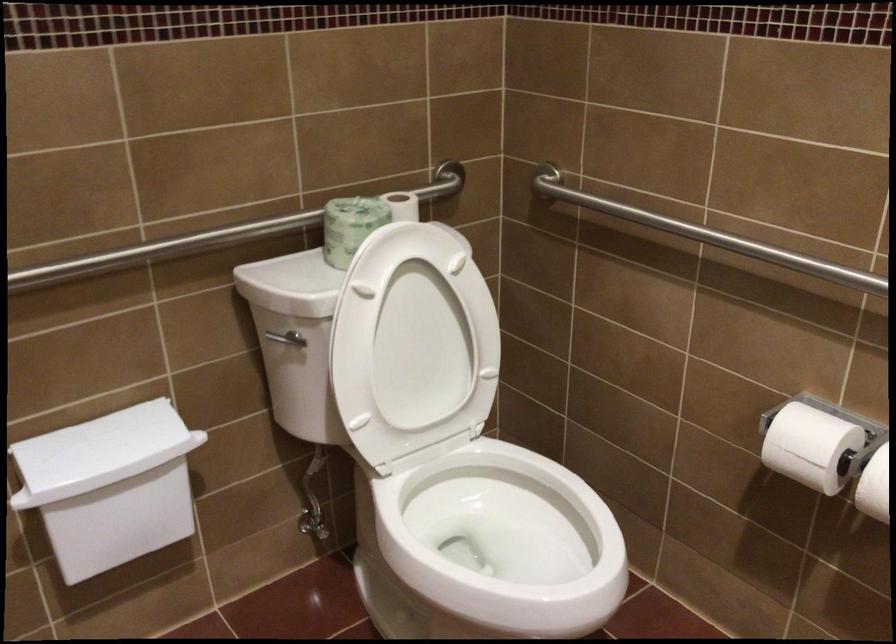
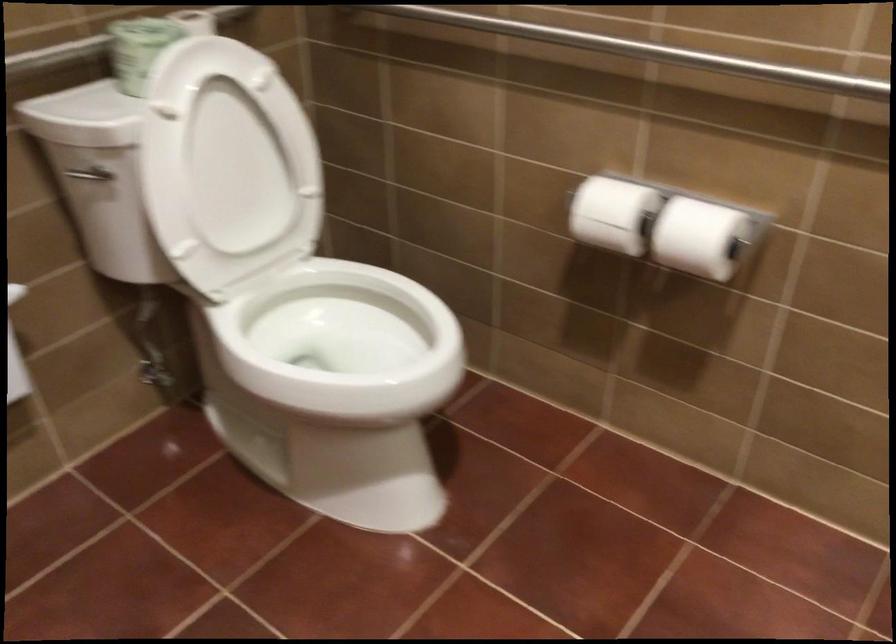
Question: The camera is either moving clockwise (left) or counter-clockwise (right) around the object. The first image is from the beginning of the video and the second image is from the end. Is the camera moving left or right when shooting the video?

Choices:
 (A) Left
 (B) Right

Answer: (A)